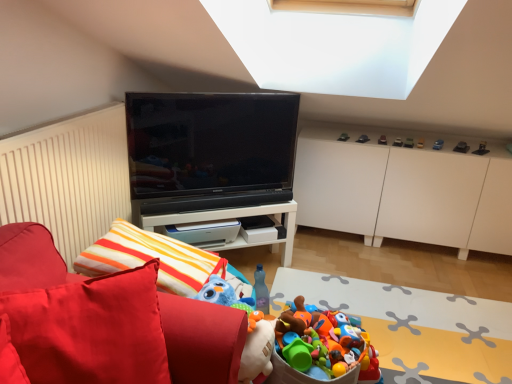
This screenshot has width=512, height=384. What are the coordinates of `unoccupied area behind metallic blue car at upper right, marked as the 7th toy in a top-to-bottom arrangement` in the screenshot? It's located at (437, 139).